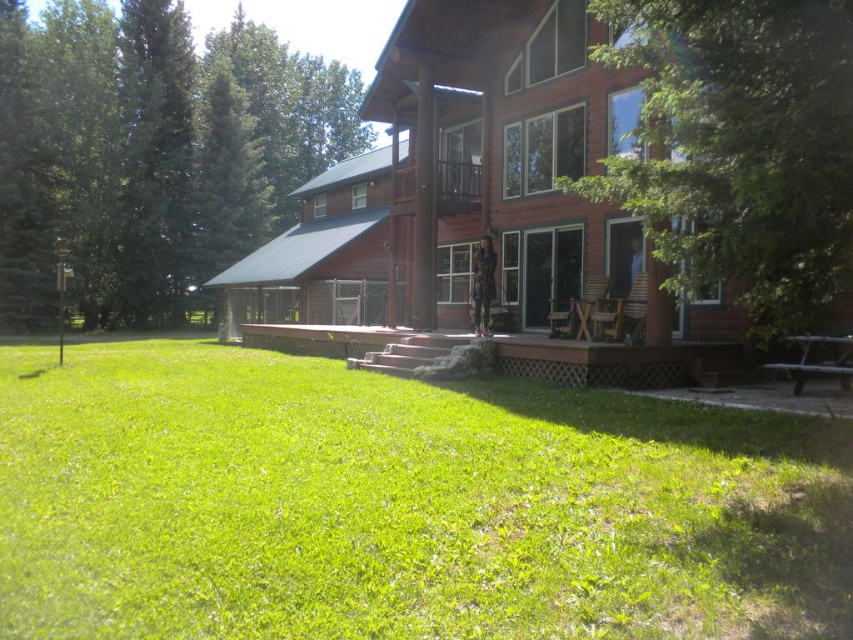
Looking at this image, you are standing on the stone pathway leading to the cabin and looking towards the front porch. You notice two green leafy trees in the upper part of the image. Which tree is closer to you, the green leafy tree at upper left or the green leafy tree at upper right?

The green leafy tree at upper left is closer to you because the green leafy tree at upper right is positioned behind it.

You are standing at the edge of the front yard and want to walk directly to the brown wooden cabin at center. According to the coordinates provided, in which direction should you head?

The brown wooden cabin at center is located at coordinates point [457,177], so you should head towards the lower left direction from your current position at the edge of the front yard.

You are a gardener who needs to mow the lawn. You see the green grass at lower left and the brown wooden cabin at center. Which area requires mowing, and why?

The green grass at lower left requires mowing because it is shorter than the brown wooden cabin at center, indicating it needs maintenance to keep it trimmed.